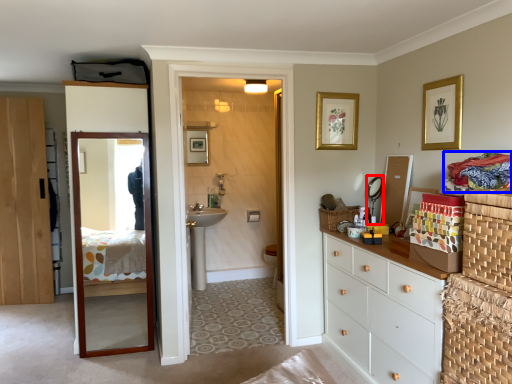
Question: Which point is closer to the camera, mirror (highlighted by a red box) or laundry (highlighted by a blue box)?

Choices:
 (A) mirror
 (B) laundry

Answer: (B)